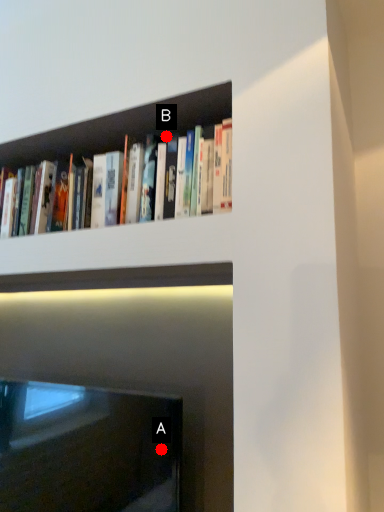
Question: Two points are circled on the image, labeled by A and B beside each circle. Which point appears farthest from the camera in this image?

Choices:
 (A) A is further
 (B) B is further

Answer: (B)